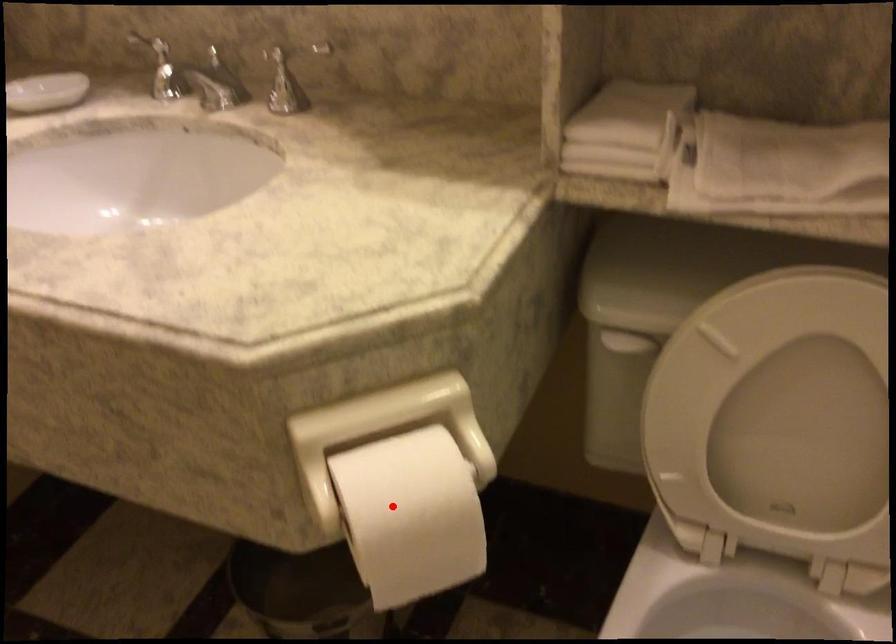
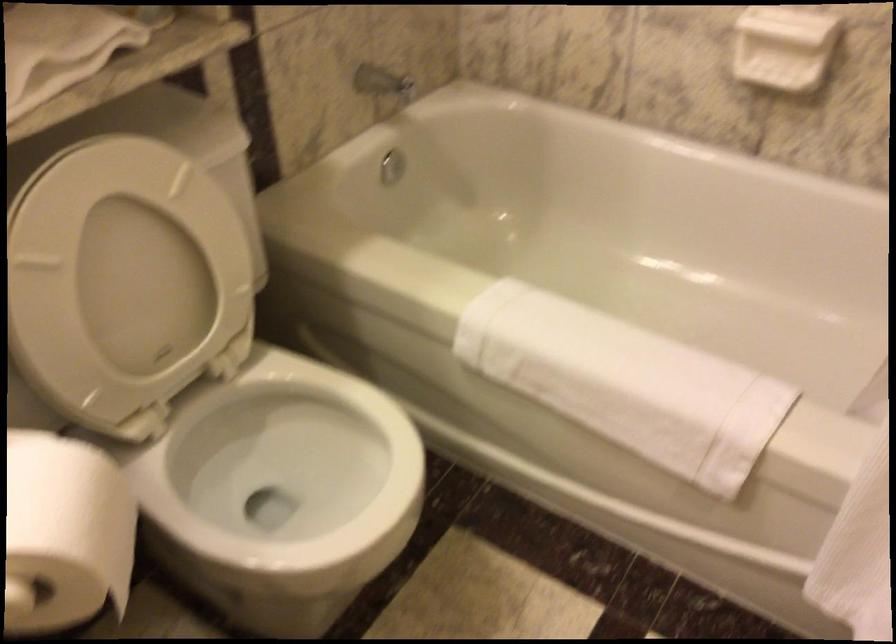
Question: I am providing you with two images of the same scene from different viewpoints. Given a red point in image1, look at the same physical point in image2. Is it:

Choices:
 (A) Closer to the viewpoint
 (B) Farther from the viewpoint

Answer: (A)